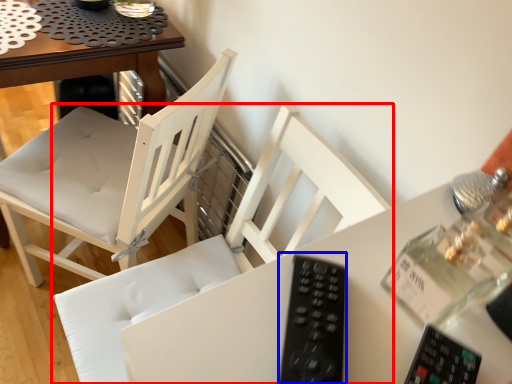
Question: Which object is further to the camera taking this photo, chair (highlighted by a red box) or remote (highlighted by a blue box)?

Choices:
 (A) chair
 (B) remote

Answer: (A)